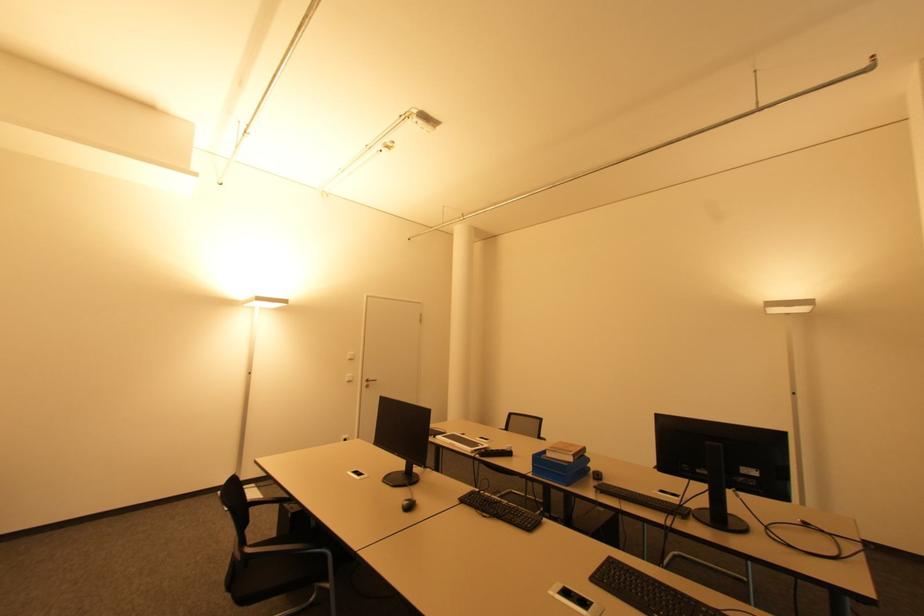
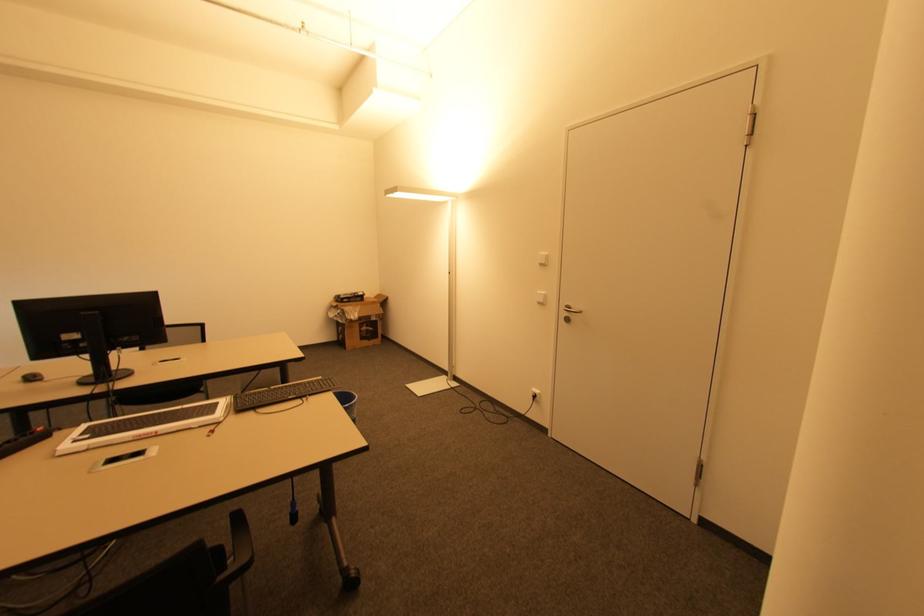
Locate, in the second image, the point that corresponds to the point at 351,360 in the first image.

(542, 265)